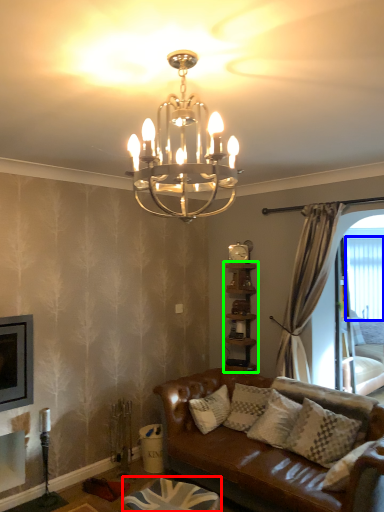
Question: Which object is positioned farthest from footrest (highlighted by a red box)? Select from window screen (highlighted by a blue box) and shelf (highlighted by a green box).

Choices:
 (A) window screen
 (B) shelf

Answer: (A)